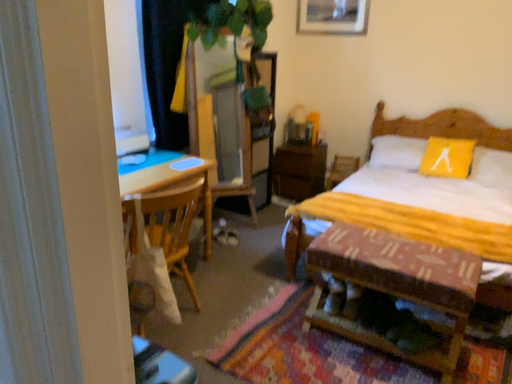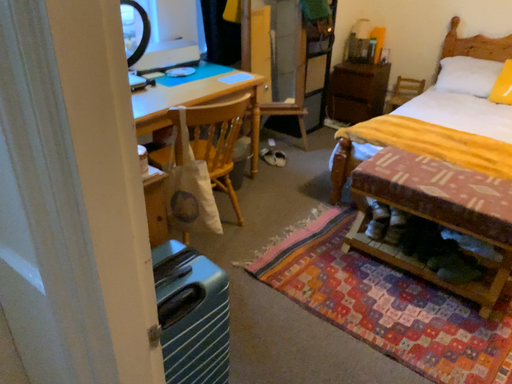
Question: Which way did the camera rotate in the video?

Choices:
 (A) rotated left
 (B) rotated right

Answer: (A)